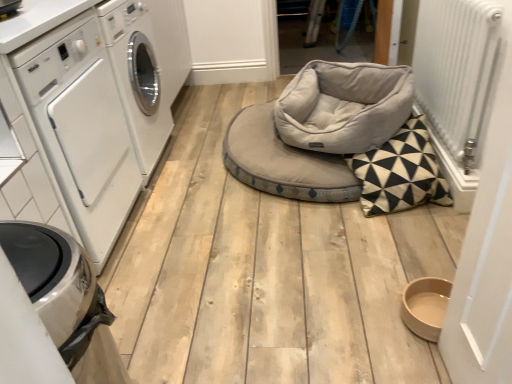
Question: Is light gray plush bean bag chair at center thinner than white metallic radiator at right?

Choices:
 (A) no
 (B) yes

Answer: (A)

Question: Is light gray plush bean bag chair at center taller than white metallic radiator at right?

Choices:
 (A) yes
 (B) no

Answer: (B)

Question: Can you confirm if light gray plush bean bag chair at center is shorter than white metallic radiator at right?

Choices:
 (A) yes
 (B) no

Answer: (A)

Question: Is the position of light gray plush bean bag chair at center less distant than that of white metallic radiator at right?

Choices:
 (A) no
 (B) yes

Answer: (A)

Question: From the image's perspective, is light gray plush bean bag chair at center below white metallic radiator at right?

Choices:
 (A) yes
 (B) no

Answer: (A)

Question: Does light gray plush bean bag chair at center have a greater width compared to white metallic radiator at right?

Choices:
 (A) no
 (B) yes

Answer: (B)

Question: Is white glossy washing machine at left outside light gray plush bean bag chair at center?

Choices:
 (A) yes
 (B) no

Answer: (A)

Question: From a real-world perspective, is white glossy washing machine at left over light gray plush bean bag chair at center?

Choices:
 (A) no
 (B) yes

Answer: (B)

Question: Can you confirm if white glossy washing machine at left is wider than light gray plush bean bag chair at center?

Choices:
 (A) no
 (B) yes

Answer: (B)

Question: From the image's perspective, is white glossy washing machine at left on light gray plush bean bag chair at center?

Choices:
 (A) no
 (B) yes

Answer: (A)

Question: Considering the relative sizes of white glossy washing machine at left and light gray plush bean bag chair at center in the image provided, is white glossy washing machine at left thinner than light gray plush bean bag chair at center?

Choices:
 (A) no
 (B) yes

Answer: (A)

Question: From a real-world perspective, does white glossy washing machine at left sit lower than light gray plush bean bag chair at center?

Choices:
 (A) yes
 (B) no

Answer: (B)

Question: Does soft gray fabric daybed at center have a greater width compared to white glossy washing machine at left?

Choices:
 (A) no
 (B) yes

Answer: (B)